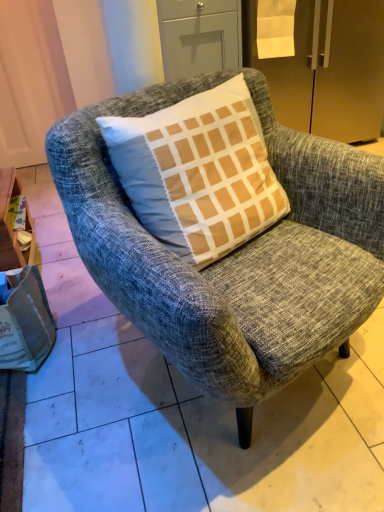
This screenshot has width=384, height=512. What are the coordinates of `vacant area located to the right-hand side of white paper bag at lower left` in the screenshot? It's located at (80, 356).